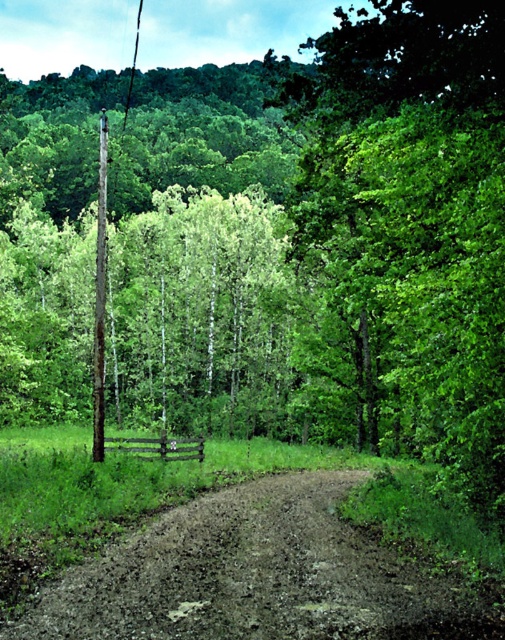
Who is positioned more to the right, brown wooden telegraph pole at left or smooth brown wooden telegraph pole at left?

Positioned to the right is brown wooden telegraph pole at left.

Is brown wooden telegraph pole at left to the right of smooth brown wooden telegraph pole at left from the viewer's perspective?

Indeed, brown wooden telegraph pole at left is positioned on the right side of smooth brown wooden telegraph pole at left.

Describe the element at coordinates (99, 296) in the screenshot. I see `brown wooden telegraph pole at left` at that location.

Find the location of `brown wooden telegraph pole at left`. brown wooden telegraph pole at left is located at coordinates (99, 296).

Based on the photo, is brown dirt track at lower center shorter than brown wooden telegraph pole at left?

Yes.

In the scene shown: Who is positioned more to the right, brown dirt track at lower center or brown wooden telegraph pole at left?

Positioned to the right is brown dirt track at lower center.

Between point (327, 531) and point (102, 440), which one is positioned in front?

Point (327, 531)

What are the coordinates of `brown dirt track at lower center` in the screenshot? It's located at (256, 577).

Who is more forward, (x=322, y=636) or (x=140, y=10)?

Point (x=322, y=636)

Is brown dirt track at lower center below smooth wire at upper center?

Correct, brown dirt track at lower center is located below smooth wire at upper center.

Locate an element on the screen. The width and height of the screenshot is (505, 640). brown dirt track at lower center is located at coordinates click(x=256, y=577).

I want to click on brown dirt track at lower center, so click(256, 577).